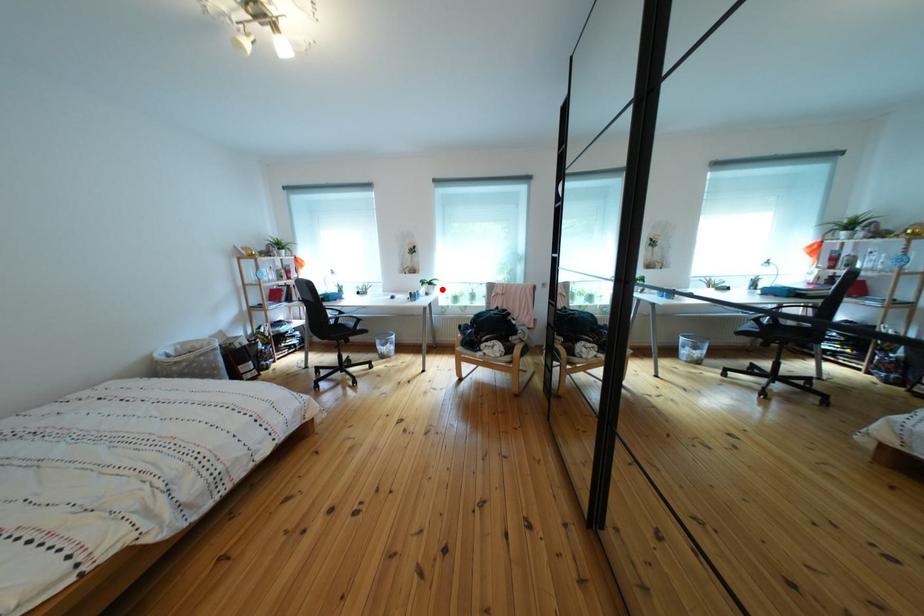
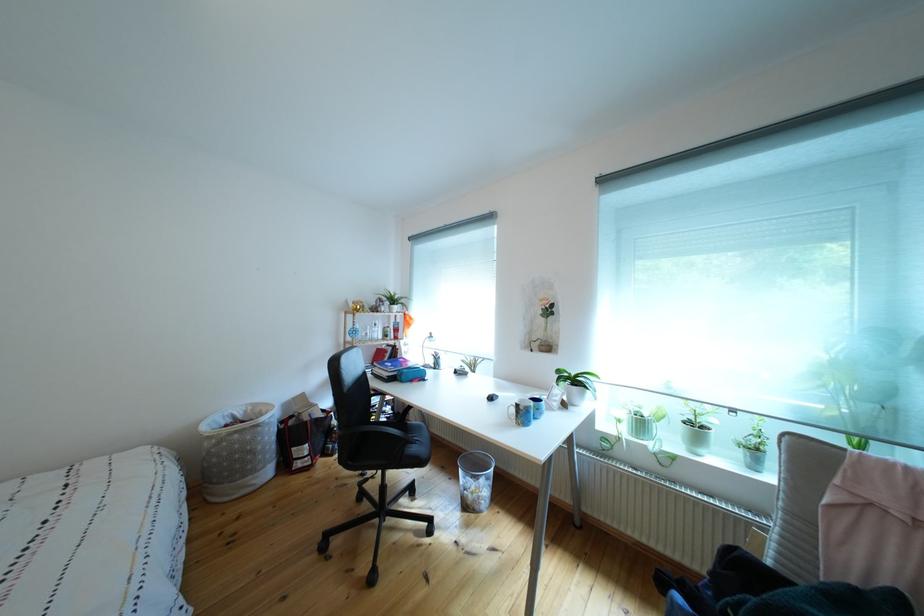
Locate, in the second image, the point that corresponds to the highlighted location in the first image.

(588, 387)